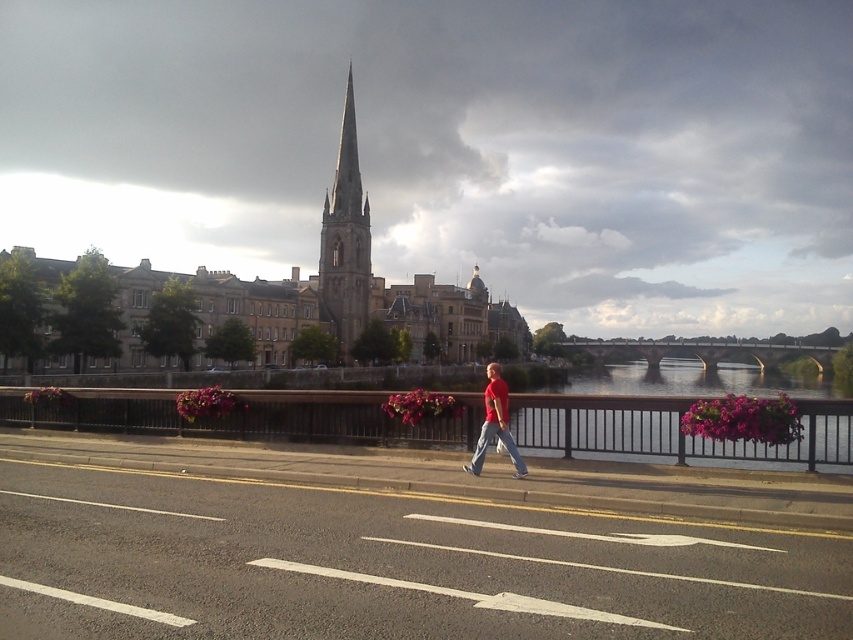
Question: Is smooth stone spire at center wider than matte red shirt at center?

Choices:
 (A) yes
 (B) no

Answer: (A)

Question: Which object appears farthest from the camera in this image?

Choices:
 (A) smooth stone spire at center
 (B) clear water at bridge right

Answer: (A)

Question: Which object is closer to the camera taking this photo?

Choices:
 (A) smooth stone spire at center
 (B) matte red shirt at center

Answer: (B)

Question: From the image, what is the correct spatial relationship of clear water at bridge right in relation to smooth stone spire at center?

Choices:
 (A) above
 (B) below

Answer: (B)

Question: Which point appears farthest from the camera in this image?

Choices:
 (A) (509, 452)
 (B) (325, 198)

Answer: (B)

Question: Can you confirm if clear water at bridge right is positioned above matte red shirt at center?

Choices:
 (A) yes
 (B) no

Answer: (B)